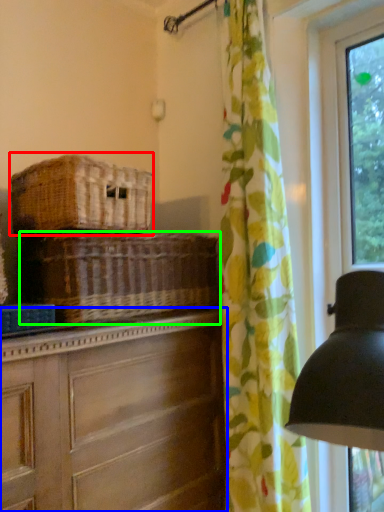
Question: Based on their relative distances, which object is nearer to basket (highlighted by a red box)? Choose from chest of drawers (highlighted by a blue box) and basket (highlighted by a green box).

Choices:
 (A) chest of drawers
 (B) basket

Answer: (B)